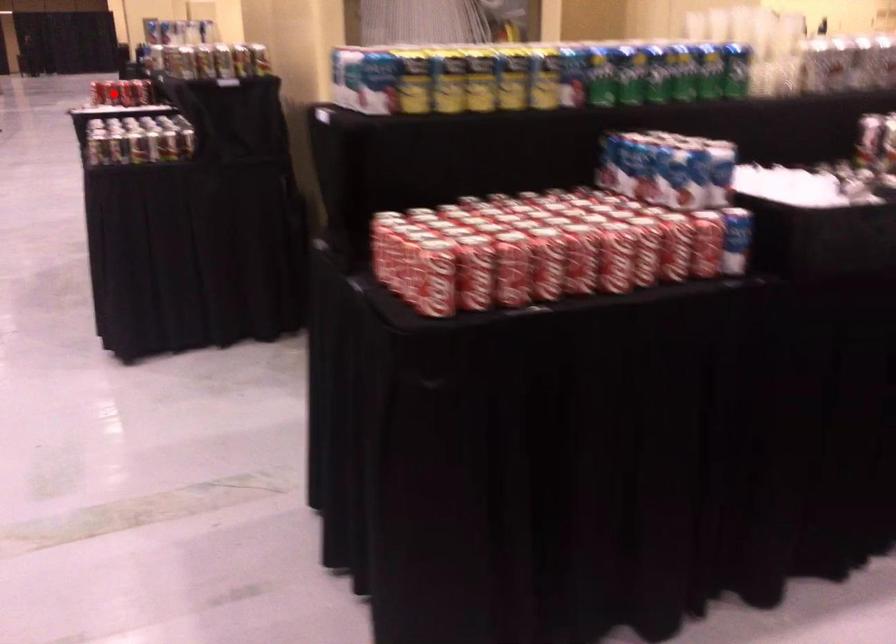
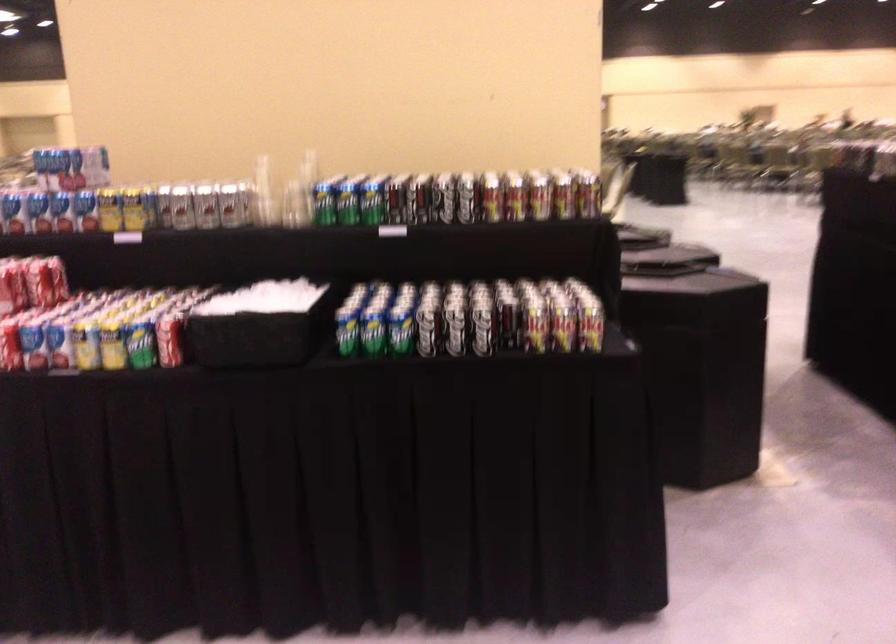
Question: I am providing you with two images of the same scene from different viewpoints. A red point is shown in image1. For the corresponding object point in image2, is it positioned nearer or farther from the camera?

Choices:
 (A) Nearer
 (B) Farther

Answer: (A)